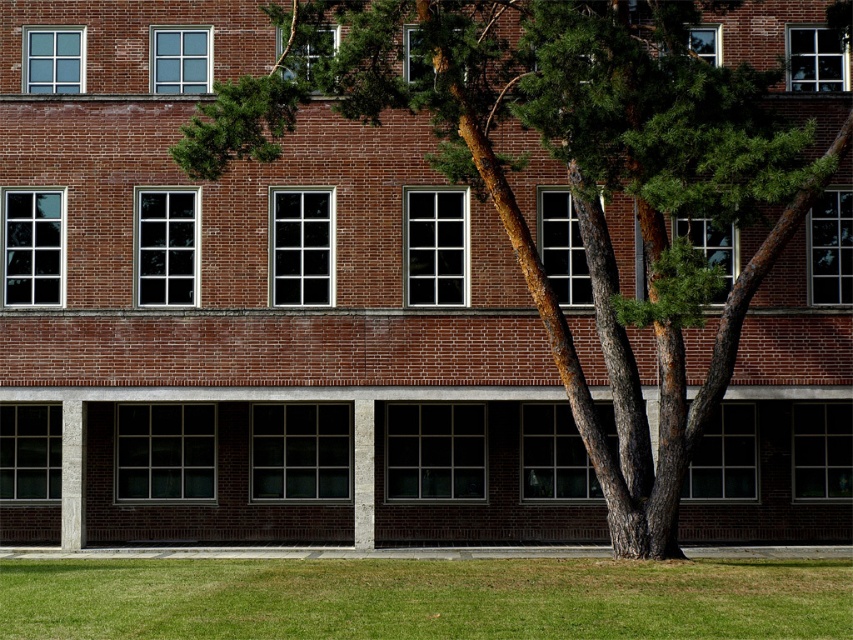
Between green textured bark at center and green grass at lower center, which one has less height?

green grass at lower center

Can you confirm if green textured bark at center is wider than green grass at lower center?

No.

This screenshot has width=853, height=640. Identify the location of green textured bark at center. (567, 179).